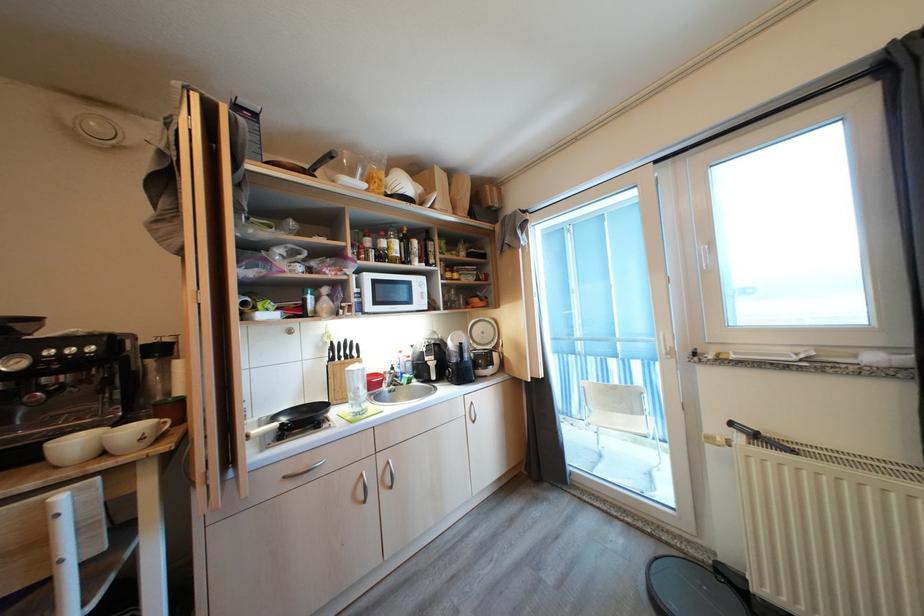
What do you see at coordinates (618, 421) in the screenshot? This screenshot has width=924, height=616. I see `the chair sitting surface` at bounding box center [618, 421].